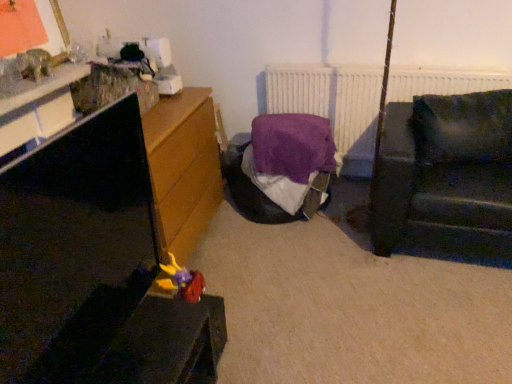
Question: Considering the positions of matt black tv stand at left and purple fabric bed at center in the image, is matt black tv stand at left taller or shorter than purple fabric bed at center?

Choices:
 (A) short
 (B) tall

Answer: (B)

Question: Is matt black tv stand at left in front of or behind purple fabric bed at center in the image?

Choices:
 (A) front
 (B) behind

Answer: (A)

Question: Based on their relative distances, which object is farther from the plush yellow and purple toy at lower left?

Choices:
 (A) dark green fabric couch at right
 (B) matt black tv stand at left
 (C) purple fabric bed at center
 (D) white matte radiator at upper center

Answer: (D)

Question: Considering the real-world distances, which object is farthest from the matt black tv stand at left?

Choices:
 (A) dark green fabric couch at right
 (B) plush yellow and purple toy at lower left
 (C) purple fabric bed at center
 (D) white matte radiator at upper center

Answer: (D)